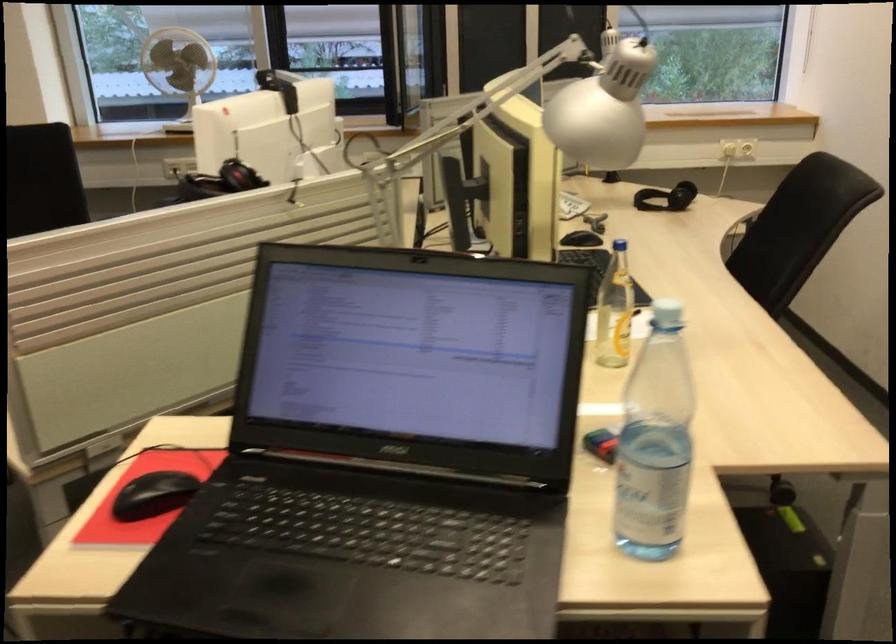
Identify the location of light blue bottle cap. coord(618,245).